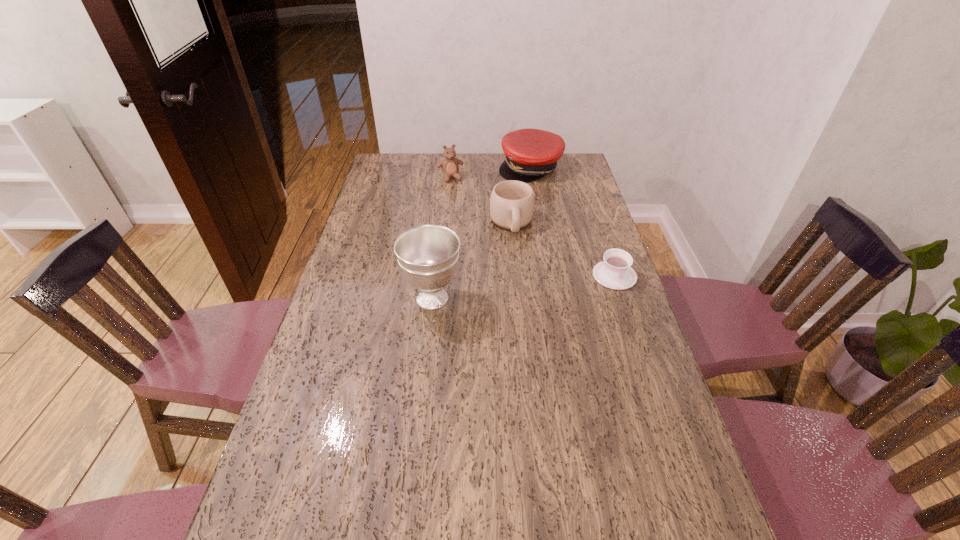
Image resolution: width=960 pixels, height=540 pixels. In order to click on the tallest object in this screenshot , I will do `click(427, 254)`.

Find the location of a particular element. The image size is (960, 540). the shortest object is located at coordinates (614, 272).

Find the location of a particular element. teacup is located at coordinates pos(614,272).

Locate an element on the screen. The width and height of the screenshot is (960, 540). cap is located at coordinates (530, 154).

Image resolution: width=960 pixels, height=540 pixels. I want to click on mug, so click(512, 203).

Find the location of a particular element. The height and width of the screenshot is (540, 960). teddy bear is located at coordinates (450, 165).

You are a GUI agent. You are given a task and a screenshot of the screen. Output one action in this format:
    pyautogui.click(x=<x>, y=<y>)
    Task: Click on the vacant position located 0.400m on the back of the chalice
    This screenshot has height=540, width=960.
    Given the screenshot: What is the action you would take?
    pyautogui.click(x=443, y=208)

Where is `free space located 0.350m on the handle side of the rightmost object`? This screenshot has width=960, height=540. free space located 0.350m on the handle side of the rightmost object is located at coordinates (653, 389).

What are the coordinates of `vacant area located 0.100m on the front-facing side of the cap` in the screenshot? It's located at (535, 197).

The height and width of the screenshot is (540, 960). I want to click on vacant region located 0.330m on the front-facing side of the cap, so click(x=540, y=231).